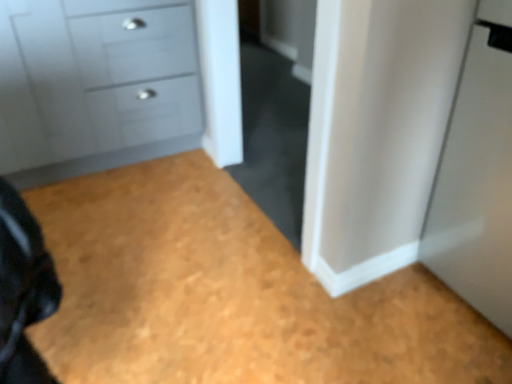
Question: Does point (2, 165) appear closer or farther from the camera than point (238, 246)?

Choices:
 (A) farther
 (B) closer

Answer: (A)

Question: From a real-world perspective, is matte gray chest of drawers at upper left positioned above or below wooden floor at lower left?

Choices:
 (A) below
 (B) above

Answer: (B)

Question: Considering the relative positions of matte gray chest of drawers at upper left and wooden floor at lower left in the image provided, is matte gray chest of drawers at upper left to the left or to the right of wooden floor at lower left?

Choices:
 (A) right
 (B) left

Answer: (B)

Question: In terms of height, does wooden floor at lower left look taller or shorter compared to matte gray chest of drawers at upper left?

Choices:
 (A) short
 (B) tall

Answer: (A)

Question: From the image's perspective, is wooden floor at lower left above or below matte gray chest of drawers at upper left?

Choices:
 (A) above
 (B) below

Answer: (B)

Question: Which is correct: wooden floor at lower left is inside matte gray chest of drawers at upper left, or outside of it?

Choices:
 (A) inside
 (B) outside

Answer: (B)

Question: In terms of size, does wooden floor at lower left appear bigger or smaller than matte gray chest of drawers at upper left?

Choices:
 (A) big
 (B) small

Answer: (B)